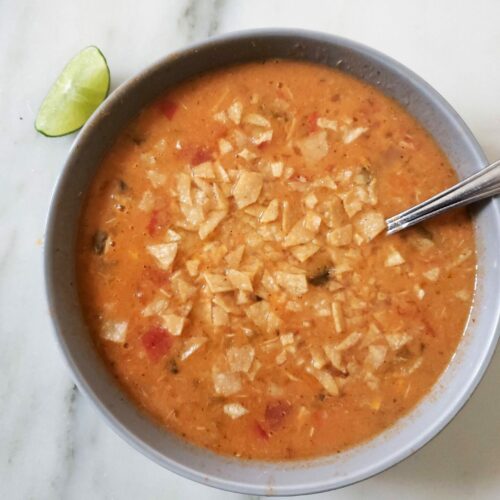
Locate an element on the screen. The height and width of the screenshot is (500, 500). white grey black marble top surface is located at coordinates (468, 46).